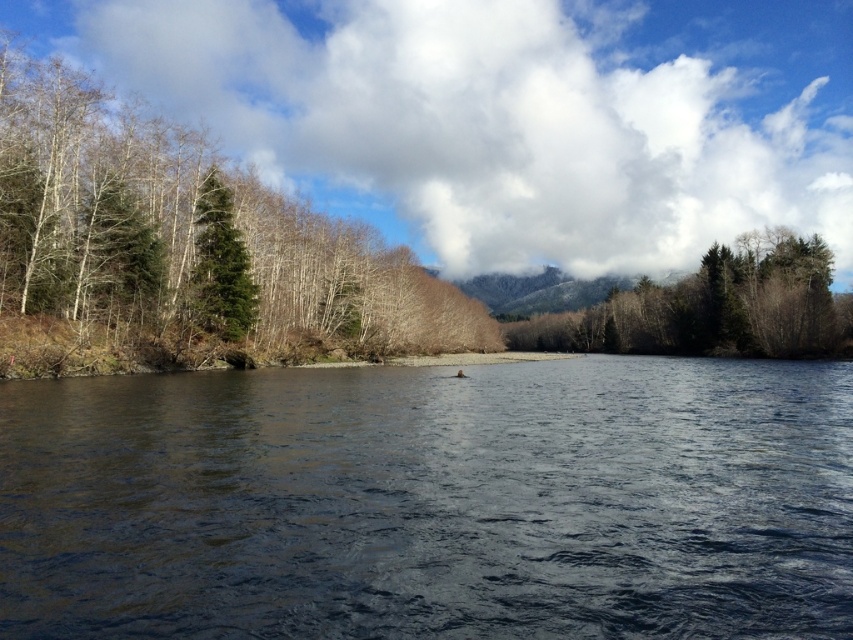
Who is lower down, dark water at center or bare branches at left?

dark water at center

Does dark water at center come in front of bare branches at left?

Yes, it is in front of bare branches at left.

Does point (833, 428) come closer to viewer compared to point (244, 228)?

That is True.

At what (x,y) coordinates should I click in order to perform the action: click on dark water at center. Please return your answer as a coordinate pair (x, y). The width and height of the screenshot is (853, 640). Looking at the image, I should click on (431, 500).

Can you confirm if green matte trees at center is taller than green matte tree at left?

Correct, green matte trees at center is much taller as green matte tree at left.

Consider the image. Can you confirm if green matte trees at center is thinner than green matte tree at left?

No, green matte trees at center is not thinner than green matte tree at left.

Describe the element at coordinates (712, 307) in the screenshot. This screenshot has height=640, width=853. I see `green matte trees at center` at that location.

Locate an element on the screen. This screenshot has height=640, width=853. green matte trees at center is located at coordinates (712, 307).

Between point (126, 264) and point (572, 324), which one is positioned behind?

The point (572, 324) is more distant.

Does point (171, 257) come in front of point (607, 324)?

That is True.

Locate an element on the screen. The width and height of the screenshot is (853, 640). bare branches at left is located at coordinates (190, 237).